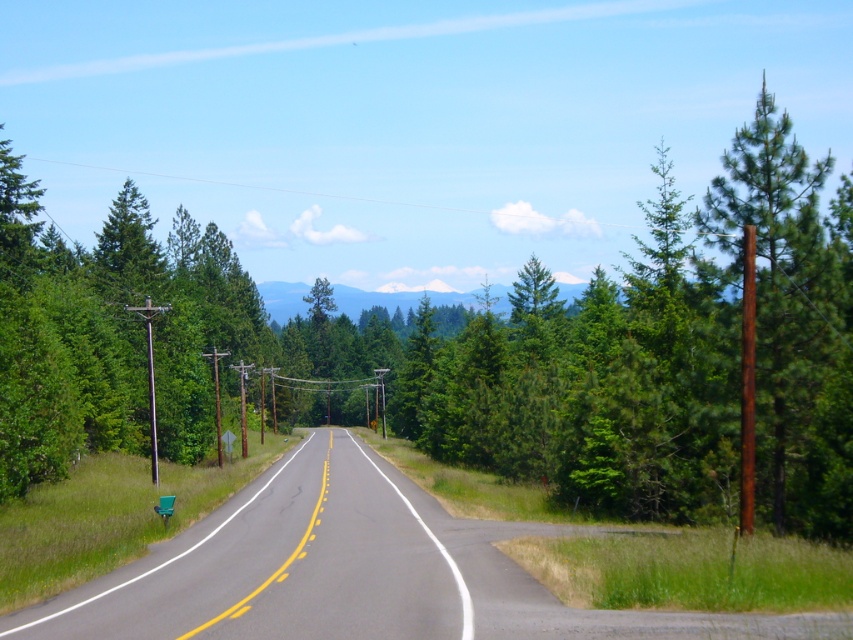
Is asphalt road at center to the left of brown rough pole at right from the viewer's perspective?

Yes, asphalt road at center is to the left of brown rough pole at right.

Identify the location of asphalt road at center. The height and width of the screenshot is (640, 853). (355, 572).

This screenshot has height=640, width=853. Find the location of `asphalt road at center`. asphalt road at center is located at coordinates (355, 572).

Identify the location of asphalt road at center. (355, 572).